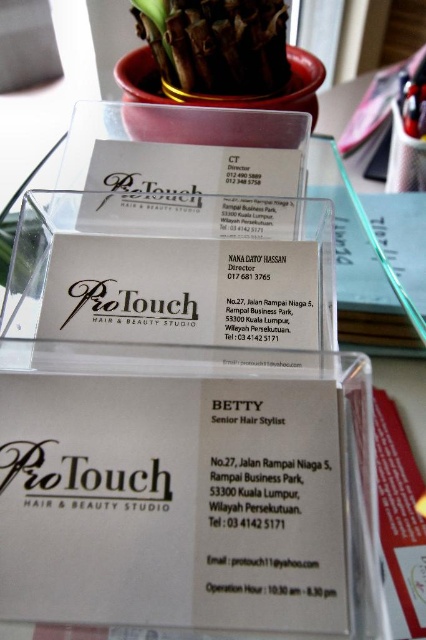
Is white paper business card at center in front of brown textured plant at upper center?

→ That is True.

In the scene shown: Who is more forward, (101, 579) or (219, 76)?

Point (101, 579) is in front.

The height and width of the screenshot is (640, 426). What are the coordinates of `white paper business card at center` in the screenshot? It's located at (172, 502).

Who is shorter, white paper business card at center or matte white card at center?

matte white card at center is shorter.

Does white paper business card at center appear on the left side of matte white card at center?

Correct, you'll find white paper business card at center to the left of matte white card at center.

The width and height of the screenshot is (426, 640). What are the coordinates of `white paper business card at center` in the screenshot? It's located at (172, 502).

You are a GUI agent. You are given a task and a screenshot of the screen. Output one action in this format:
    pyautogui.click(x=<x>, y=<y>)
    Task: Click on the matte gold card at center
    Image resolution: width=426 pixels, height=640 pixels.
    Given the screenshot: What is the action you would take?
    pyautogui.click(x=181, y=291)

Who is more distant from viewer, (54, 252) or (273, 88)?

Positioned behind is point (273, 88).

Is point (261, 262) positioned behind point (256, 52)?

No, it is in front of (256, 52).

Find the location of a particular element. This screenshot has height=640, width=426. matte gold card at center is located at coordinates (181, 291).